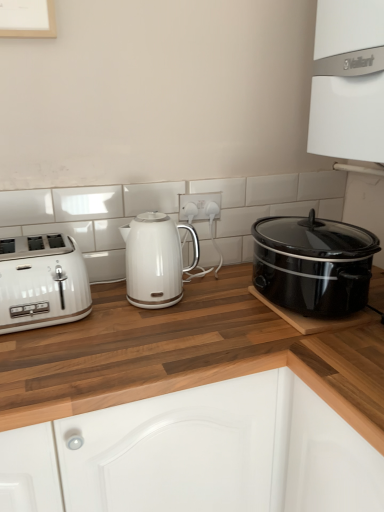
The width and height of the screenshot is (384, 512). In order to click on white glossy kettle at center in this screenshot , I will do `click(156, 260)`.

Identify the location of white glossy toaster at left. This screenshot has width=384, height=512. (42, 282).

What do you see at coordinates (184, 355) in the screenshot?
I see `wooden at left` at bounding box center [184, 355].

Where is `white glossy kettle at center`? white glossy kettle at center is located at coordinates (156, 260).

Is wooden at left in front of or behind white plastic electric outlet at center in the image?

In the image, wooden at left appears in front of white plastic electric outlet at center.

Is wooden at left wider or thinner than white plastic electric outlet at center?

Clearly, wooden at left has more width compared to white plastic electric outlet at center.

Is wooden at left taller than white plastic electric outlet at center?

Indeed, wooden at left has a greater height compared to white plastic electric outlet at center.

How different are the orientations of wooden at left and black glossy slow cooker at right in degrees?

89.7 degrees separate the facing orientations of wooden at left and black glossy slow cooker at right.

From the image's perspective, is wooden at left positioned above or below black glossy slow cooker at right?

Clearly, from the image's perspective, wooden at left is below black glossy slow cooker at right.

Is wooden at left not close to black glossy slow cooker at right?

No.

Which is behind, wooden at left or black glossy slow cooker at right?

black glossy slow cooker at right is more distant.

From a real-world perspective, between white glossy kettle at center and white glossy vaillant boiler at upper right, who is vertically higher?

white glossy vaillant boiler at upper right, from a real-world perspective.

Which of these two, white glossy kettle at center or white glossy vaillant boiler at upper right, is bigger?

Bigger between the two is white glossy vaillant boiler at upper right.

Which object is wider, white glossy kettle at center or white glossy vaillant boiler at upper right?

white glossy vaillant boiler at upper right.

Is point (129, 236) closer or farther from the camera than point (361, 3)?

Point (129, 236) is farther from the camera than point (361, 3).

Which object is further away from the camera taking this photo, black glossy slow cooker at right or white glossy vaillant boiler at upper right?

black glossy slow cooker at right is further from the camera.

Find the location of a particular element. The width and height of the screenshot is (384, 512). slow cooker that appears below the white glossy vaillant boiler at upper right (from the image's perspective) is located at coordinates (313, 264).

Consider the image. Does black glossy slow cooker at right turn towards white glossy vaillant boiler at upper right?

No, black glossy slow cooker at right is not aimed at white glossy vaillant boiler at upper right.

Which object is positioned more to the left, white glossy kettle at center or white plastic electric outlet at center?

From the viewer's perspective, white glossy kettle at center appears more on the left side.

From the image's perspective, who appears lower, white glossy kettle at center or white plastic electric outlet at center?

white glossy kettle at center appears lower in the image.

Is white glossy kettle at center not within white plastic electric outlet at center?

That's correct, white glossy kettle at center is outside of white plastic electric outlet at center.

Can you tell me how much white glossy kettle at center and white plastic electric outlet at center differ in facing direction?

0.00303 degrees.

Who is taller, white glossy kettle at center or black glossy slow cooker at right?

Standing taller between the two is white glossy kettle at center.

Between white glossy kettle at center and black glossy slow cooker at right, which one has larger width?

black glossy slow cooker at right is wider.

At what (x,y) coordinates should I click in order to perform the action: click on slow cooker below the white glossy kettle at center (from the image's perspective). Please return your answer as a coordinate pair (x, y). Image resolution: width=384 pixels, height=512 pixels. Looking at the image, I should click on (313, 264).

Between white glossy kettle at center and black glossy slow cooker at right, which one appears on the left side from the viewer's perspective?

Positioned to the left is white glossy kettle at center.

In the scene shown: Between white glossy vaillant boiler at upper right and white plastic electric outlet at center, which one appears on the left side from the viewer's perspective?

white plastic electric outlet at center is more to the left.

Locate an element on the screen. The image size is (384, 512). oven lying on the right of white plastic electric outlet at center is located at coordinates (348, 81).

Would you say white glossy vaillant boiler at upper right is a long distance from white plastic electric outlet at center?

No, white glossy vaillant boiler at upper right is in close proximity to white plastic electric outlet at center.

Is white glossy vaillant boiler at upper right positioned in front of white plastic electric outlet at center?

Yes, the depth of white glossy vaillant boiler at upper right is less than that of white plastic electric outlet at center.

I want to click on counter top that appears in front of the white plastic electric outlet at center, so click(x=184, y=355).

The height and width of the screenshot is (512, 384). I want to click on counter top on the left of black glossy slow cooker at right, so click(x=184, y=355).

Looking at the image, which one is located closer to white glossy vaillant boiler at upper right, black glossy slow cooker at right or white glossy toaster at left?

black glossy slow cooker at right is closer to white glossy vaillant boiler at upper right.

Looking at the image, which one is located closer to black glossy slow cooker at right, white glossy kettle at center or wooden at left?

wooden at left lies closer to black glossy slow cooker at right than the other object.

Which object lies nearer to the anchor point white plastic electric outlet at center, black glossy slow cooker at right or wooden at left?

black glossy slow cooker at right.

Which object lies further to the anchor point wooden at left, black glossy slow cooker at right or white glossy vaillant boiler at upper right?

The object further to wooden at left is white glossy vaillant boiler at upper right.

From the picture: Estimate the real-world distances between objects in this image. Which object is closer to white glossy toaster at left, black glossy slow cooker at right or wooden at left?

Among the two, wooden at left is located nearer to white glossy toaster at left.

When comparing their distances from white glossy vaillant boiler at upper right, does white glossy toaster at left or white plastic electric outlet at center seem further?

Based on the image, white glossy toaster at left appears to be further to white glossy vaillant boiler at upper right.

Which object lies nearer to the anchor point white glossy toaster at left, white plastic electric outlet at center or black glossy slow cooker at right?

white plastic electric outlet at center is positioned closer to the anchor white glossy toaster at left.

From the image, which object appears to be nearer to white glossy kettle at center, white glossy toaster at left or white plastic electric outlet at center?

Based on the image, white glossy toaster at left appears to be nearer to white glossy kettle at center.

Where is `slow cooker between white plastic electric outlet at center and wooden at left vertically`? This screenshot has width=384, height=512. slow cooker between white plastic electric outlet at center and wooden at left vertically is located at coordinates (313, 264).

This screenshot has width=384, height=512. In order to click on electric outlet between white glossy kettle at center and white glossy vaillant boiler at upper right in the horizontal direction in this screenshot , I will do `click(199, 205)`.

In order to click on kettle between white glossy toaster at left and black glossy slow cooker at right from left to right in this screenshot , I will do `click(156, 260)`.

Where is `kettle between white glossy vaillant boiler at upper right and wooden at left in the vertical direction`? The image size is (384, 512). kettle between white glossy vaillant boiler at upper right and wooden at left in the vertical direction is located at coordinates (156, 260).